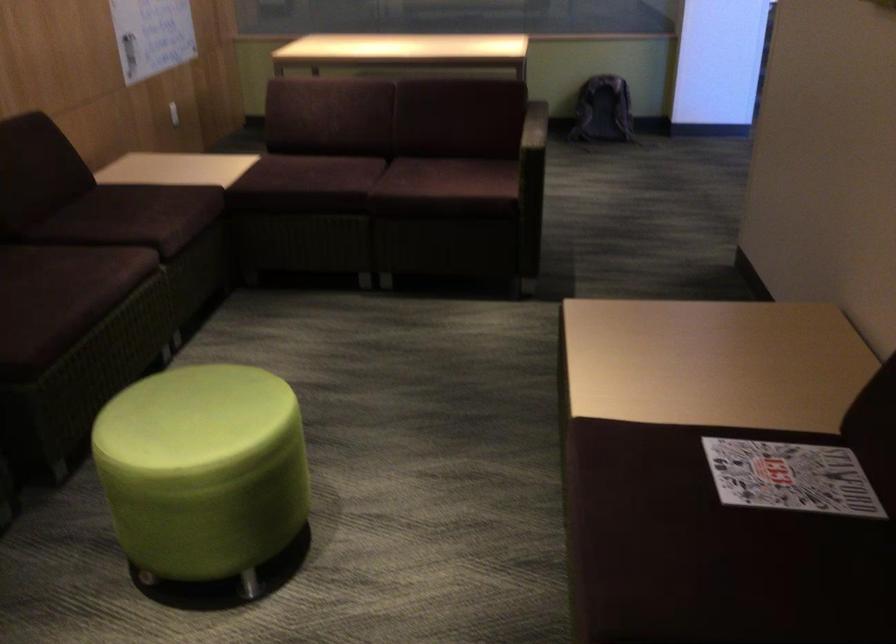
Where is `green stool`? The height and width of the screenshot is (644, 896). green stool is located at coordinates (203, 471).